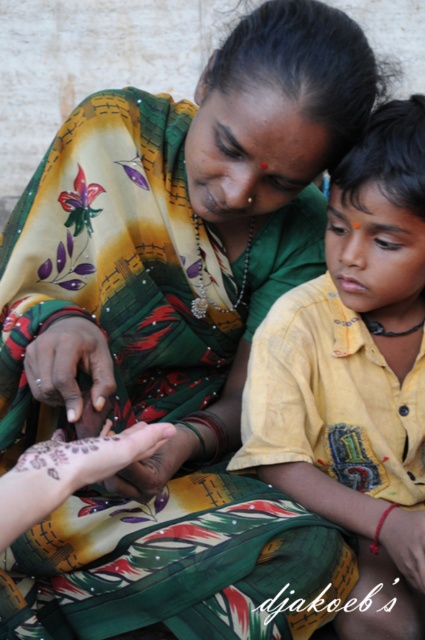
You are an artist sketching this scene and need to determine which point is closer to you. Which of the two points, point (362,582) or point (56,385), is closer to your viewpoint?

Point (56,385) is closer to the viewer because the description states that point (362,582) is further away than point (56,385).

In the scene described, where exactly is the yellow cotton shirt at center located in terms of coordinates?

The yellow cotton shirt at center is located at point coordinates of 0.577 in the x axis and 0.833 in the y axis.

In the scene where a woman and a child are sitting together, you notice the yellow cotton shirt at center and the dark skin hand at center. Which object is located to the right of the other?

The yellow cotton shirt at center is positioned on the right side of dark skin hand at center.